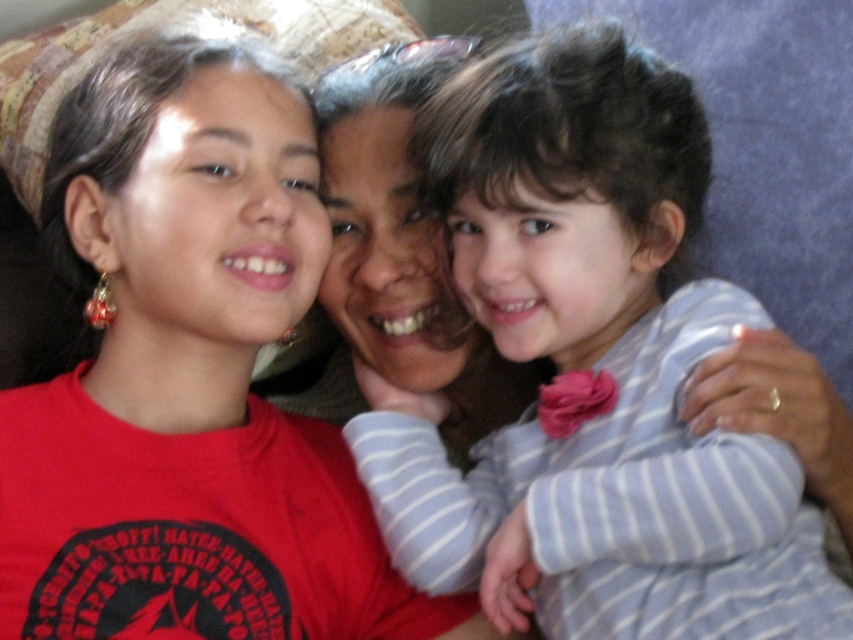
Does striped fabric dress at center appear over matte brown hair at center?

Yes, striped fabric dress at center is above matte brown hair at center.

Does striped fabric dress at center have a greater height compared to matte brown hair at center?

No.

Identify the location of striped fabric dress at center. This screenshot has height=640, width=853. (590, 369).